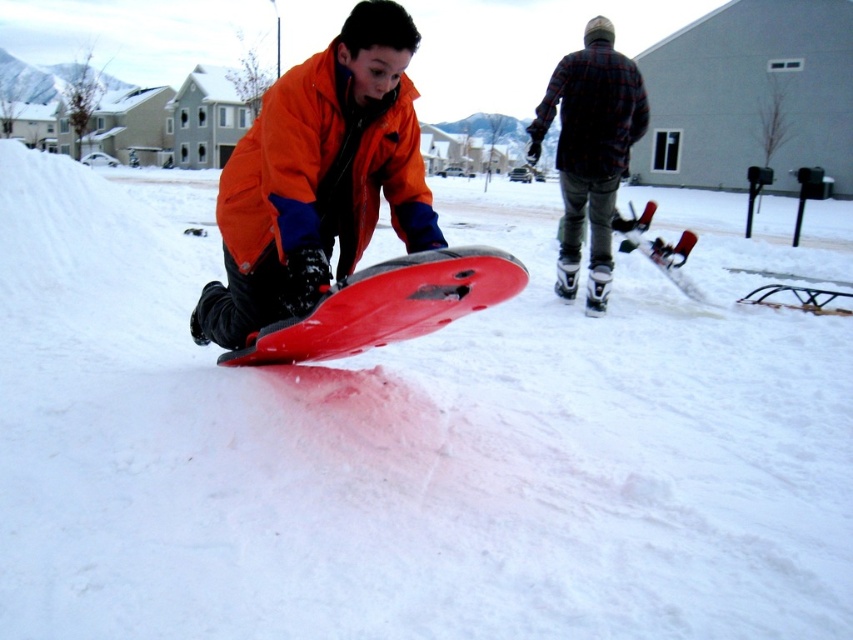
You are planning to take a photo of the flannel plaid shirt at upper right and the matte red snowboard at center. Which object should be placed closer to the camera to ensure both are in focus?

The flannel plaid shirt at upper right is shorter than the matte red snowboard at center. To ensure both are in focus, the flannel plaid shirt at upper right should be placed closer to the camera so that their heights align within the focal range.

You are standing at the point labeled point (593, 52) and want to walk towards the point labeled point (682, 241). Which direction should you face to move towards the second point?

To move from point (593, 52) to point (682, 241), you should face towards the upper right direction since point (682, 241) is located behind point (593, 52).